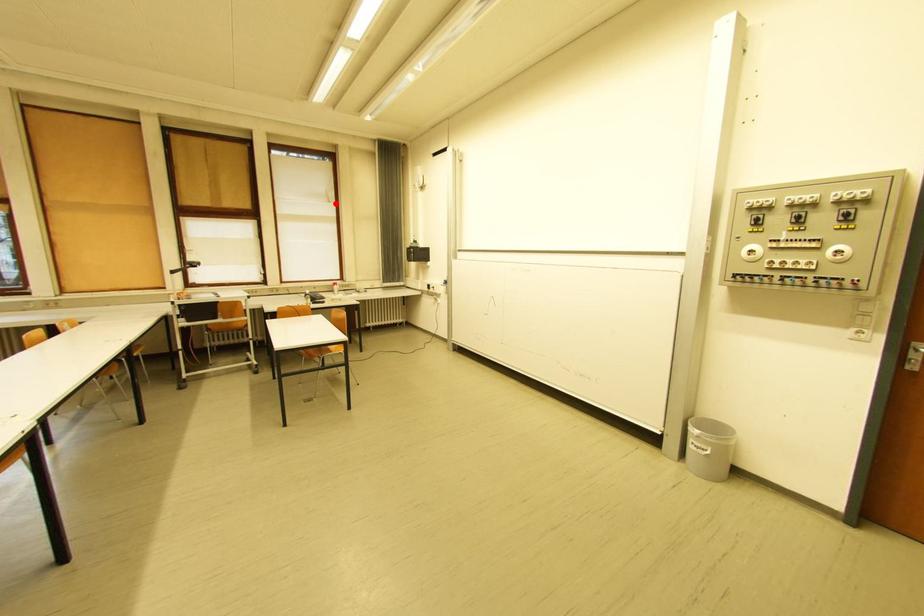
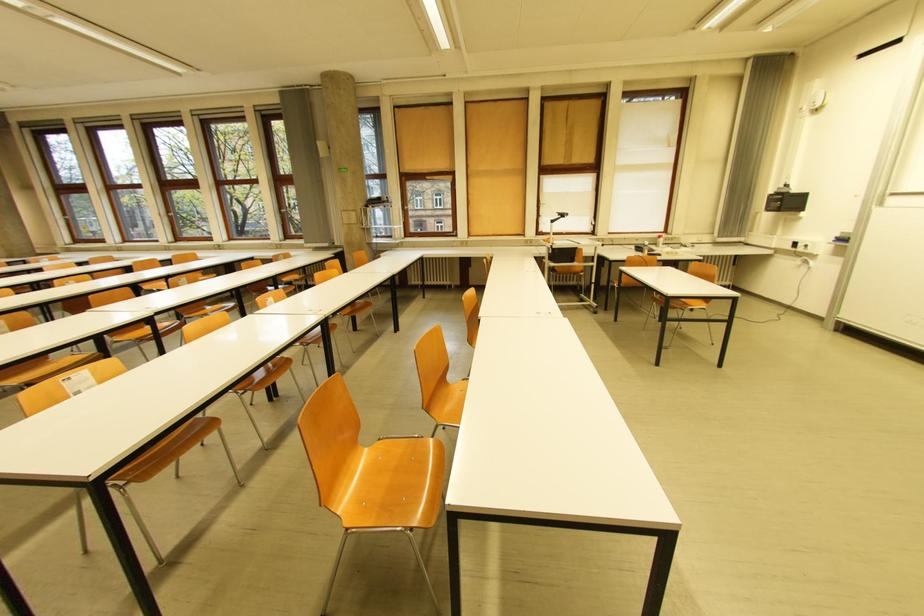
Locate, in the second image, the point that corresponds to the highlighted location in the first image.

(676, 148)